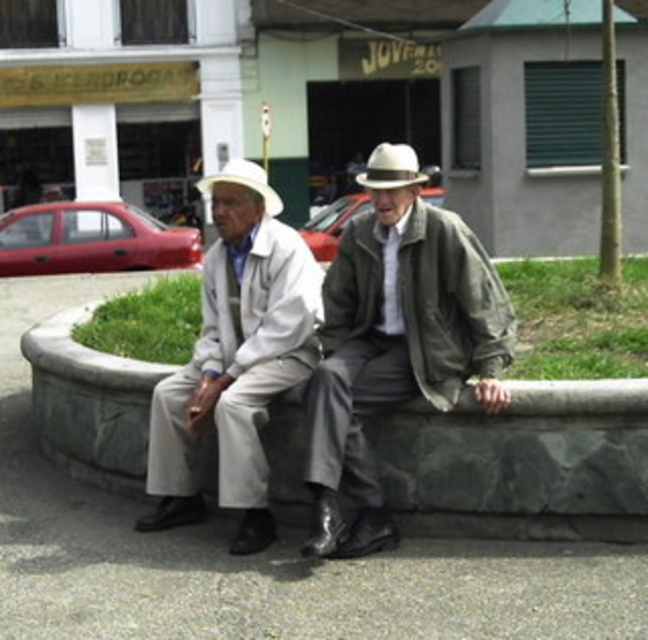
Question: Is the position of light beige fabric coat at center more distant than that of white matte cowboy hat at center?

Choices:
 (A) yes
 (B) no

Answer: (B)

Question: Does light beige fabric coat at center have a smaller size compared to white felt fedora at center?

Choices:
 (A) no
 (B) yes

Answer: (B)

Question: Does matte gray coat at center come in front of white matte cowboy hat at center?

Choices:
 (A) no
 (B) yes

Answer: (B)

Question: Estimate the real-world distances between objects in this image. Which object is closer to the white felt fedora at center?

Choices:
 (A) gray stone curb at center
 (B) matte gray coat at center

Answer: (B)

Question: Among these points, which one is farthest from the camera?

Choices:
 (A) (343, 385)
 (B) (222, 460)
 (C) (203, 186)

Answer: (C)

Question: Based on their relative distances, which object is farther from the light beige fabric coat at center?

Choices:
 (A) gray stone curb at center
 (B) white felt fedora at center
 (C) white matte cowboy hat at center

Answer: (C)